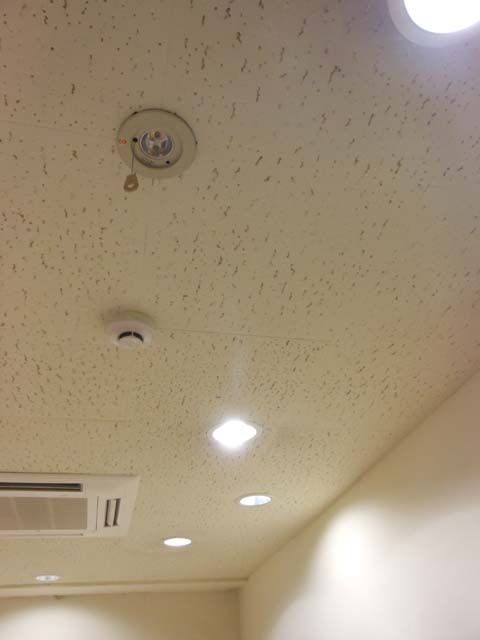
Image resolution: width=480 pixels, height=640 pixels. In order to click on grey dots on ceiling in this screenshot , I will do `click(258, 176)`, `click(253, 269)`.